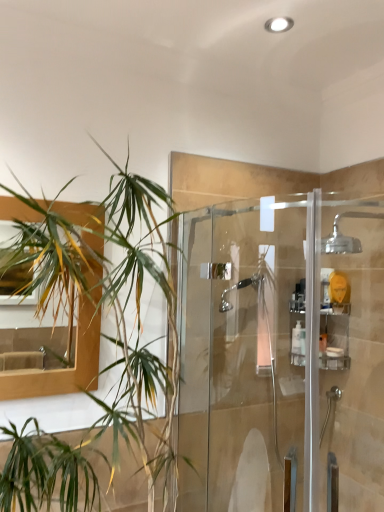
Identify the location of white plastic bottle at center. (296, 338).

What is the approximate height of clear plastic shelf at upper right?

clear plastic shelf at upper right is 12.75 inches tall.

Where is `clear plastic shelf at upper right`? This screenshot has width=384, height=512. clear plastic shelf at upper right is located at coordinates (334, 337).

This screenshot has height=512, width=384. What do you see at coordinates (96, 344) in the screenshot?
I see `green leafy plant at left` at bounding box center [96, 344].

Where is `green leafy plant at left`? The width and height of the screenshot is (384, 512). green leafy plant at left is located at coordinates (96, 344).

Find the location of a particular element. The image size is (384, 512). white plastic bottle at center is located at coordinates (296, 338).

Does clear plastic shelf at upper right have a larger size compared to chrome metallic showerhead at upper right?

Incorrect, clear plastic shelf at upper right is not larger than chrome metallic showerhead at upper right.

Considering the positions of points (343, 369) and (337, 228), is point (343, 369) farther from camera compared to point (337, 228)?

No, (343, 369) is closer to viewer.

Measure the distance from clear plastic shelf at upper right to chrome metallic showerhead at upper right.

clear plastic shelf at upper right and chrome metallic showerhead at upper right are 15.99 inches apart.

Does clear plastic shelf at upper right have a greater width compared to chrome metallic showerhead at upper right?

No.

From the image's perspective, is clear plastic shelf at upper right on white plastic bottle at center?

Indeed, from the image's perspective, clear plastic shelf at upper right is shown above white plastic bottle at center.

Is clear plastic shelf at upper right next to white plastic bottle at center and touching it?

No, clear plastic shelf at upper right is not in contact with white plastic bottle at center.

Is clear plastic shelf at upper right spatially inside white plastic bottle at center, or outside of it?

clear plastic shelf at upper right is located beyond the bounds of white plastic bottle at center.

Based on their sizes in the image, would you say clear plastic shelf at upper right is bigger or smaller than white plastic bottle at center?

clear plastic shelf at upper right is bigger than white plastic bottle at center.

Considering the positions of objects chrome metallic showerhead at upper right and green leafy plant at left in the image provided, who is more to the right, chrome metallic showerhead at upper right or green leafy plant at left?

From the viewer's perspective, chrome metallic showerhead at upper right appears more on the right side.

Which is behind, chrome metallic showerhead at upper right or green leafy plant at left?

chrome metallic showerhead at upper right is further from the camera.

Can you confirm if green leafy plant at left is taller than chrome metallic showerhead at upper right?

Yes.

Considering the points (157, 339) and (349, 247), which point is in front, point (157, 339) or point (349, 247)?

The point (157, 339) is closer.

Is green leafy plant at left facing towards chrome metallic showerhead at upper right?

No, green leafy plant at left is not aimed at chrome metallic showerhead at upper right.

Considering the relative positions of green leafy plant at left and chrome metallic showerhead at upper right in the image provided, is green leafy plant at left to the left or to the right of chrome metallic showerhead at upper right?

green leafy plant at left is positioned on chrome metallic showerhead at upper right's left side.

Is clear glass shower door at center completely or partially outside of green leafy plant at left?

That's correct, clear glass shower door at center is outside of green leafy plant at left.

Are clear glass shower door at center and green leafy plant at left far apart?

No, there isn't a large distance between clear glass shower door at center and green leafy plant at left.

Between clear glass shower door at center and green leafy plant at left, which one appears on the right side from the viewer's perspective?

Positioned to the right is clear glass shower door at center.

Between clear glass shower door at center and green leafy plant at left, which one has larger size?

green leafy plant at left.

Locate an element on the screen. Image resolution: width=384 pixels, height=512 pixels. houseplant above the white plastic bottle at center (from the image's perspective) is located at coordinates (96, 344).

Which of these two, green leafy plant at left or white plastic bottle at center, is smaller?

Smaller between the two is white plastic bottle at center.

Considering the relative positions of green leafy plant at left and white plastic bottle at center in the image provided, is green leafy plant at left to the left or to the right of white plastic bottle at center?

From the image, it's evident that green leafy plant at left is to the left of white plastic bottle at center.

Between green leafy plant at left and white plastic bottle at center, which one has more height?

green leafy plant at left.

In the scene shown: Is clear glass shower door at center far from chrome metallic showerhead at upper right?

clear glass shower door at center is near chrome metallic showerhead at upper right, not far away.

Which of these two, clear glass shower door at center or chrome metallic showerhead at upper right, stands shorter?

Result: Standing shorter between the two is chrome metallic showerhead at upper right.

Is clear glass shower door at center positioned with its back to chrome metallic showerhead at upper right?

Yes.

Locate an element on the screen. shelf that appears below the chrome metallic showerhead at upper right (from the image's perspective) is located at coordinates (334, 337).

Identify the location of shelf in front of the white plastic bottle at center. This screenshot has width=384, height=512. (334, 337).

Based on their spatial positions, is clear glass shower door at center or clear plastic shelf at upper right closer to white plastic bottle at center?

clear plastic shelf at upper right is closer to white plastic bottle at center.

Based on their spatial positions, is chrome metallic showerhead at upper right or white plastic bottle at center further from clear plastic shelf at upper right?

chrome metallic showerhead at upper right lies further to clear plastic shelf at upper right than the other object.

Looking at the image, which one is located further to clear plastic shelf at upper right, white plastic bottle at center or green leafy plant at left?

green leafy plant at left lies further to clear plastic shelf at upper right than the other object.

When comparing their distances from chrome metallic showerhead at upper right, does white plastic bottle at center or clear glass shower door at center seem further?

clear glass shower door at center is further to chrome metallic showerhead at upper right.

Estimate the real-world distances between objects in this image. Which object is closer to clear plastic shelf at upper right, white plastic bottle at center or clear glass shower door at center?

white plastic bottle at center is closer to clear plastic shelf at upper right.

Looking at the image, which one is located further to white plastic bottle at center, clear plastic shelf at upper right or chrome metallic showerhead at upper right?

chrome metallic showerhead at upper right.

Which object lies nearer to the anchor point chrome metallic showerhead at upper right, clear plastic shelf at upper right or white plastic bottle at center?

clear plastic shelf at upper right is closer to chrome metallic showerhead at upper right.

Looking at the image, which one is located further to chrome metallic showerhead at upper right, white plastic bottle at center or green leafy plant at left?

Based on the image, green leafy plant at left appears to be further to chrome metallic showerhead at upper right.

What are the coordinates of `shower positioned between green leafy plant at left and white plastic bottle at center from near to far` in the screenshot? It's located at pyautogui.click(x=344, y=234).

You are a GUI agent. You are given a task and a screenshot of the screen. Output one action in this format:
    pyautogui.click(x=<x>, y=<y>)
    Task: Click on the shelf between chrome metallic showerhead at upper right and white plastic bottle at center from top to bottom
    Image resolution: width=384 pixels, height=512 pixels.
    Given the screenshot: What is the action you would take?
    pyautogui.click(x=334, y=337)

Where is `screen door between green leafy plant at left and chrome metallic showerhead at upper right from left to right`? This screenshot has width=384, height=512. screen door between green leafy plant at left and chrome metallic showerhead at upper right from left to right is located at coordinates (282, 354).

Where is `screen door positioned between green leafy plant at left and clear plastic shelf at upper right from near to far`? This screenshot has width=384, height=512. screen door positioned between green leafy plant at left and clear plastic shelf at upper right from near to far is located at coordinates (282, 354).